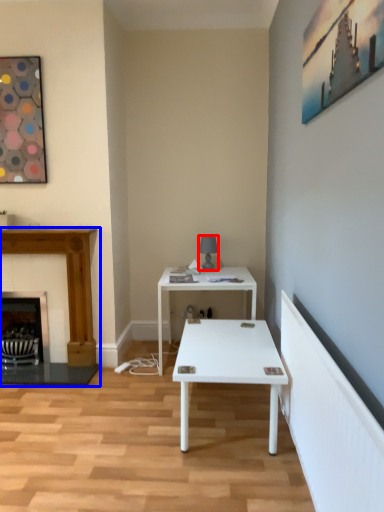
Question: Which object appears closest to the camera in this image, table lamp (highlighted by a red box) or fireplace (highlighted by a blue box)?

Choices:
 (A) table lamp
 (B) fireplace

Answer: (B)